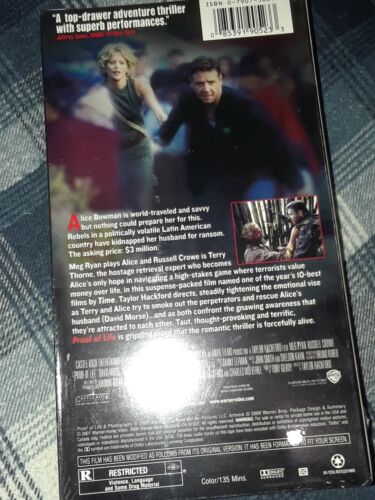
Find the location of a particular element. lights is located at coordinates (155, 370).